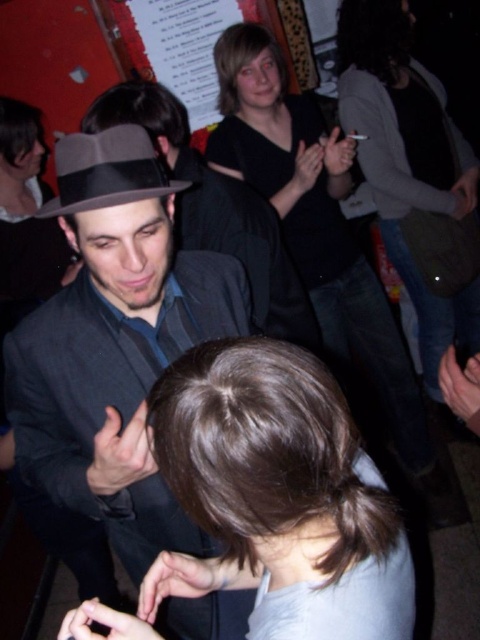
Question: From the image, what is the correct spatial relationship of matte black suit at center in relation to brown hair at center?

Choices:
 (A) above
 (B) below

Answer: (A)

Question: Which point is farther to the camera?

Choices:
 (A) gray felt fedora at center
 (B) matte gray hat at center
 (C) brown hair at center
 (D) dark gray sweater at upper right

Answer: (D)

Question: Estimate the real-world distances between objects in this image. Which object is closer to the dark gray sweater at upper right?

Choices:
 (A) matte gray hat at center
 (B) matte black suit at center
 (C) black matte shirt at center

Answer: (C)

Question: Is matte black suit at center closer to the viewer compared to black matte shirt at center?

Choices:
 (A) yes
 (B) no

Answer: (A)

Question: Does matte gray hat at center have a smaller size compared to gray felt fedora at center?

Choices:
 (A) yes
 (B) no

Answer: (B)

Question: Which object is the closest to the gray felt fedora at center?

Choices:
 (A) matte black suit at center
 (B) matte gray hat at center

Answer: (A)